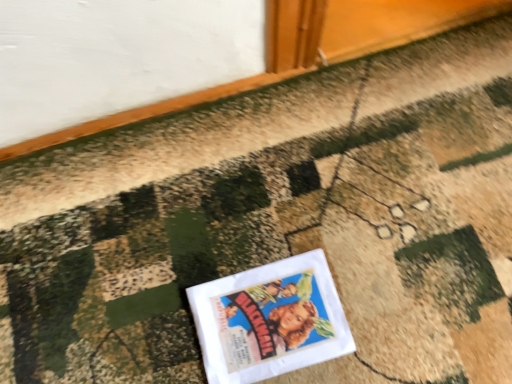
Describe the element at coordinates (271, 320) in the screenshot. The width and height of the screenshot is (512, 384). I see `white paper comic book at center` at that location.

I want to click on white paper comic book at center, so click(271, 320).

You are a GUI agent. You are given a task and a screenshot of the screen. Output one action in this format:
    pyautogui.click(x=<x>, y=<y>)
    Task: Click on the white paper comic book at center
    The image size is (512, 384).
    Given the screenshot: What is the action you would take?
    [x=271, y=320]